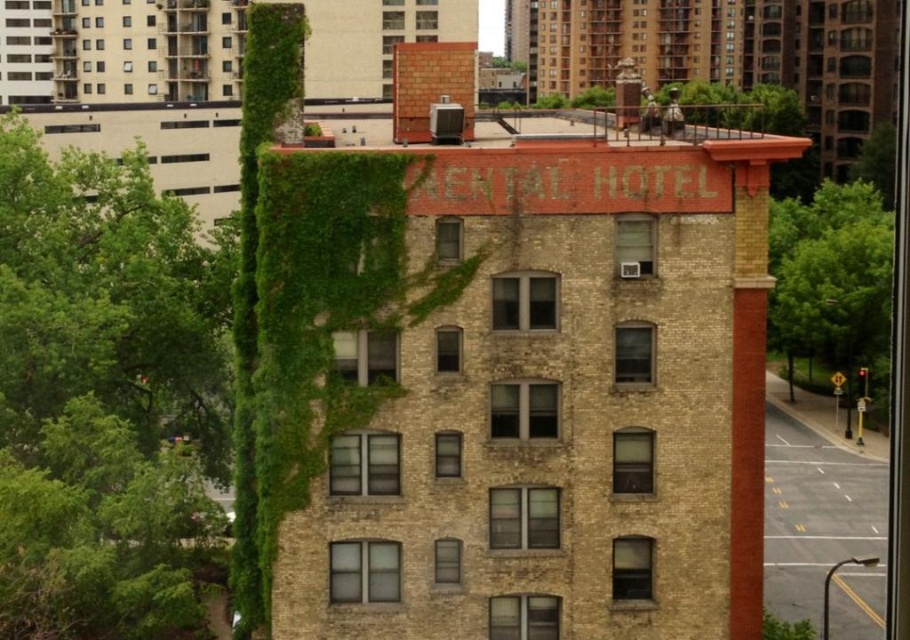
You are standing in front of the Central Hotel building. You see a point marked at coordinate (106, 397). What does this point represent?

The point at coordinate (106, 397) represents the green leafy tree at left.

You are a gardener who needs to trim the trees in front of the Central Hotel. You see the green leafy tree at left and the green leafy tree at right. Which tree requires more pruning because it has a thicker trunk?

The green leafy tree at right requires more pruning because it is thicker than the green leafy tree at left.